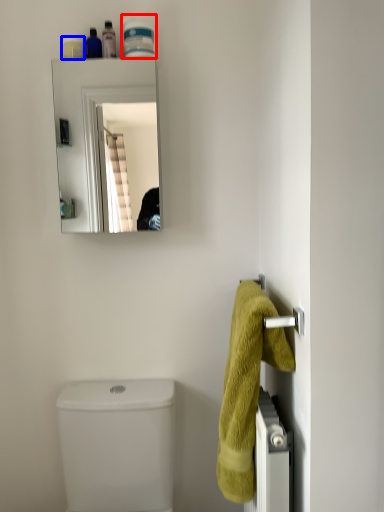
Question: Among these objects, which one is nearest to the camera, toiletry (highlighted by a red box) or toiletry (highlighted by a blue box)?

Choices:
 (A) toiletry
 (B) toiletry

Answer: (A)